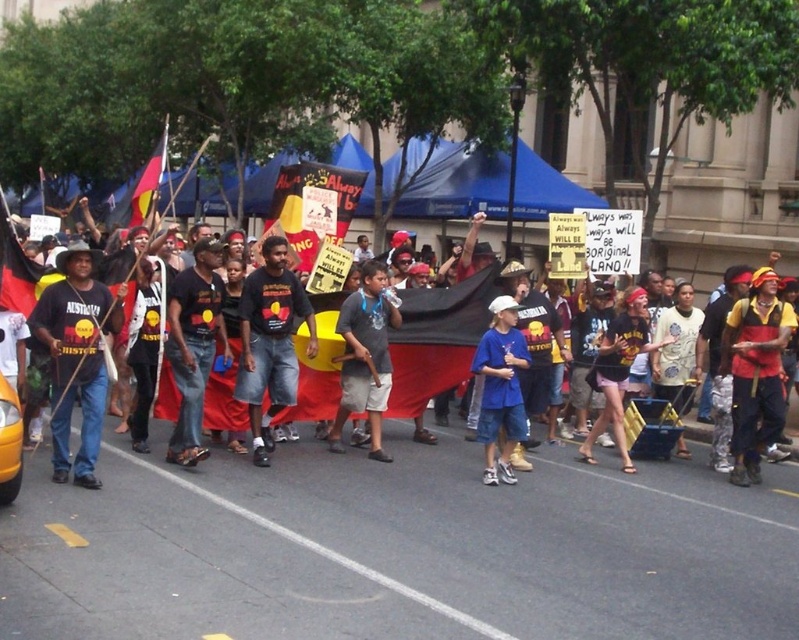
You are a participant in the protest and want to move from your current position to the front of the crowd. You notice two points marked on the ground ahead of you. The first point is at coordinates point [177,333] and the second is at point [495,465]. Which point should you head towards to reach the front of the crowd more quickly?

You should head towards point [177,333] because it is in front of point [495,465], so it is closer to the front of the crowd.